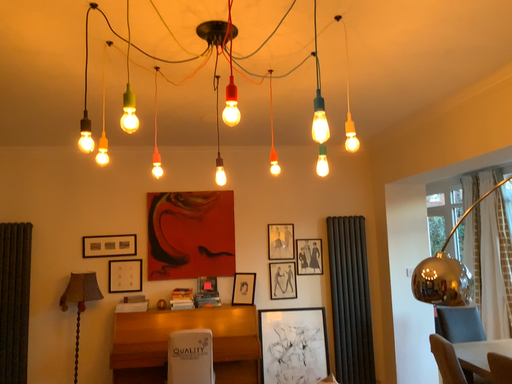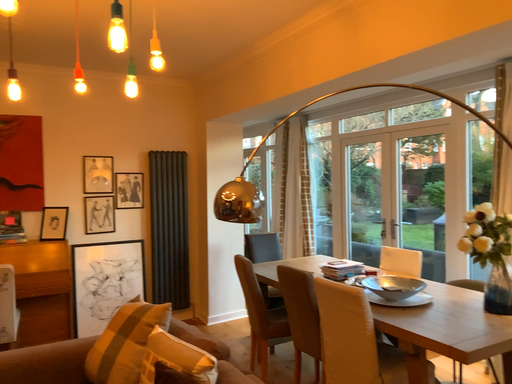
Question: How did the camera likely rotate when shooting the video?

Choices:
 (A) rotated left
 (B) rotated right

Answer: (B)